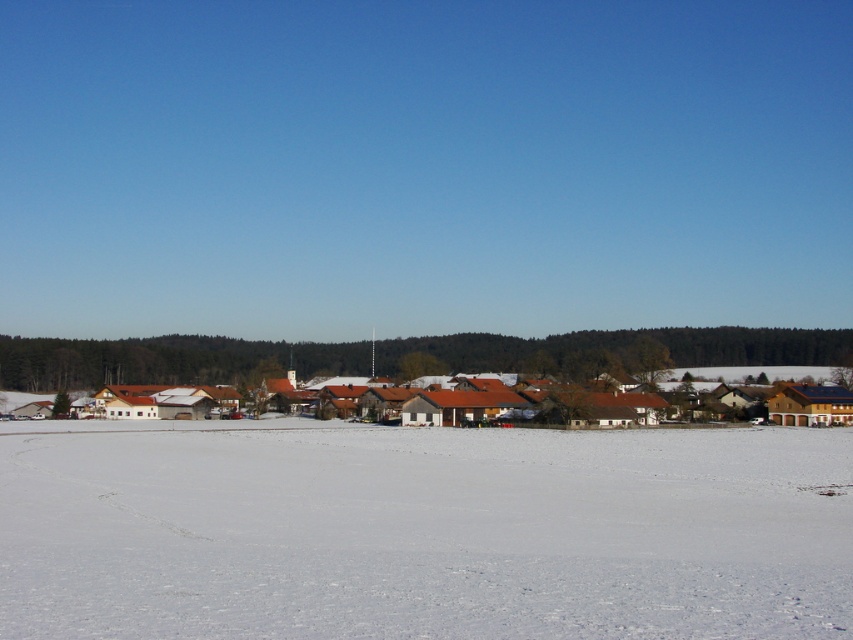
Between point (39, 541) and point (798, 417), which one is positioned behind?

Positioned behind is point (798, 417).

Can you confirm if white powdery snow at center is wider than brown wooden houses at center?

In fact, white powdery snow at center might be narrower than brown wooden houses at center.

You are a GUI agent. You are given a task and a screenshot of the screen. Output one action in this format:
    pyautogui.click(x=<x>, y=<y>)
    Task: Click on the white powdery snow at center
    This screenshot has width=853, height=640.
    Given the screenshot: What is the action you would take?
    pyautogui.click(x=427, y=532)